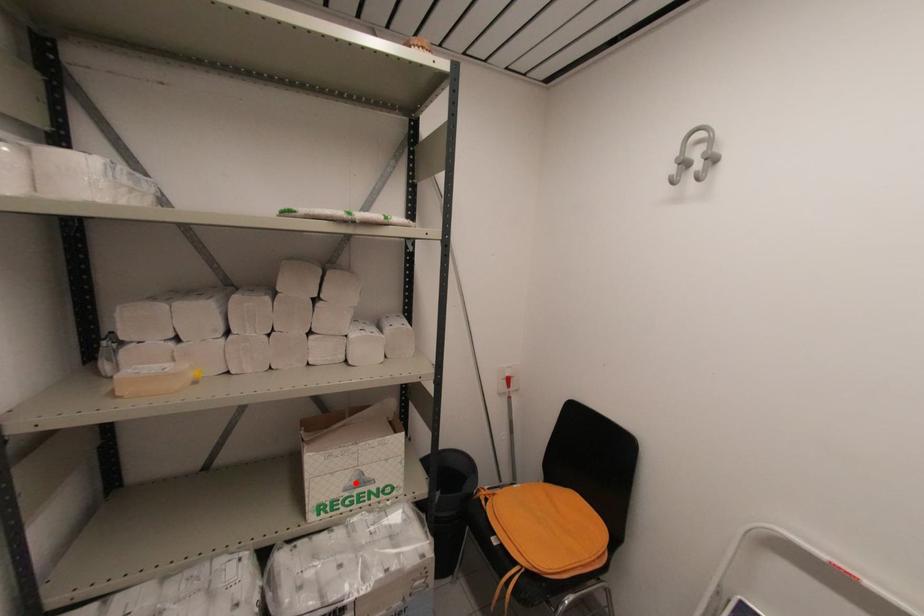
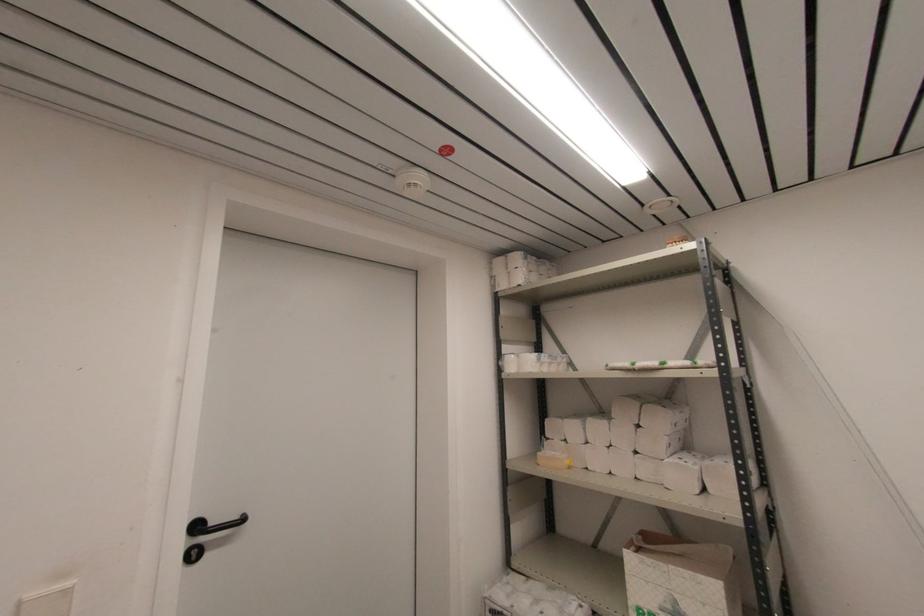
Question: I am providing you with two images of the same scene from different viewpoints. Image1 has a red point marked. In image2, the corresponding 3D location appears at what relative position? Reply with the corresponding letter.

Choices:
 (A) Closer
 (B) Farther

Answer: (A)